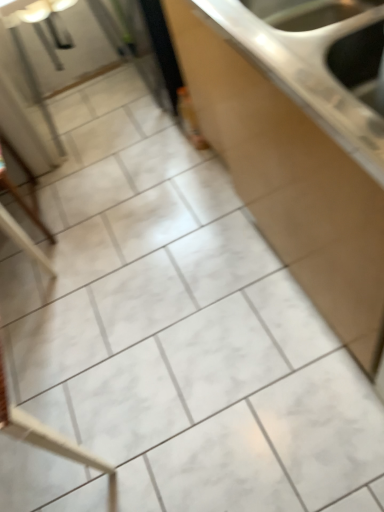
Question: Is wooden chair at left far away from white glossy countertop at center?

Choices:
 (A) no
 (B) yes

Answer: (A)

Question: Is wooden chair at left at the right side of white glossy countertop at center?

Choices:
 (A) yes
 (B) no

Answer: (B)

Question: From a real-world perspective, is wooden chair at left physically below white glossy countertop at center?

Choices:
 (A) yes
 (B) no

Answer: (A)

Question: Does wooden chair at left turn towards white glossy countertop at center?

Choices:
 (A) yes
 (B) no

Answer: (B)

Question: Is wooden chair at left smaller than white glossy countertop at center?

Choices:
 (A) no
 (B) yes

Answer: (B)

Question: Considering the relative sizes of wooden chair at left and white glossy countertop at center in the image provided, is wooden chair at left shorter than white glossy countertop at center?

Choices:
 (A) no
 (B) yes

Answer: (B)

Question: Does white glossy countertop at center turn towards wooden chair at left?

Choices:
 (A) yes
 (B) no

Answer: (A)

Question: Is white glossy countertop at center taller than wooden chair at left?

Choices:
 (A) no
 (B) yes

Answer: (B)

Question: Is white glossy countertop at center closer to camera compared to wooden chair at left?

Choices:
 (A) yes
 (B) no

Answer: (A)

Question: From the image's perspective, would you say white glossy countertop at center is positioned over wooden chair at left?

Choices:
 (A) yes
 (B) no

Answer: (A)

Question: Is white glossy countertop at center surrounding wooden chair at left?

Choices:
 (A) no
 (B) yes

Answer: (A)

Question: Does white glossy countertop at center have a lesser width compared to wooden chair at left?

Choices:
 (A) yes
 (B) no

Answer: (A)

Question: Does point (34, 247) appear closer or farther from the camera than point (332, 316)?

Choices:
 (A) farther
 (B) closer

Answer: (A)